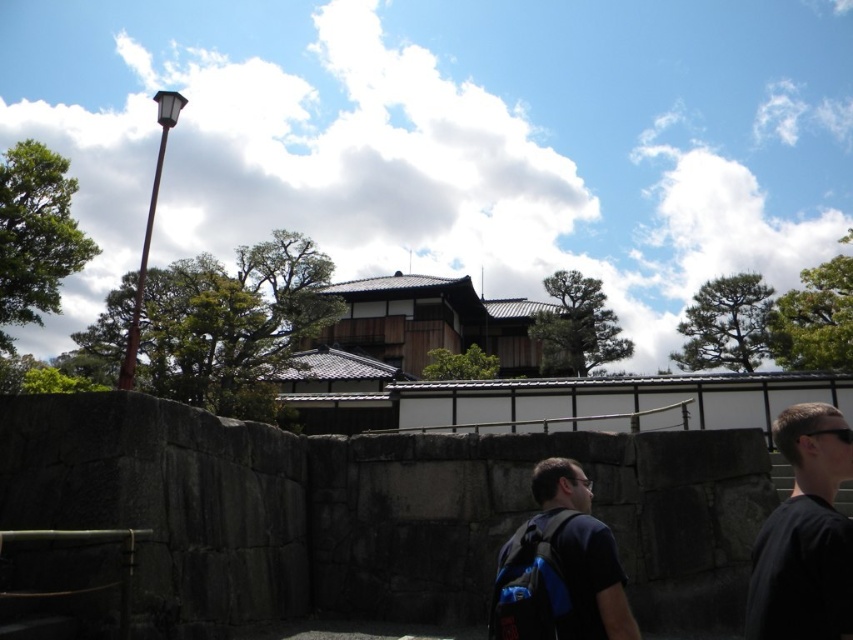
Between black fabric shirt at right and dark blue backpack at center, which one has less height?

With less height is black fabric shirt at right.

This screenshot has width=853, height=640. What do you see at coordinates (805, 536) in the screenshot?
I see `black fabric shirt at right` at bounding box center [805, 536].

You are a GUI agent. You are given a task and a screenshot of the screen. Output one action in this format:
    pyautogui.click(x=<x>, y=<y>)
    Task: Click on the black fabric shirt at right
    This screenshot has width=853, height=640.
    Given the screenshot: What is the action you would take?
    pyautogui.click(x=805, y=536)

Who is lower down, black fabric shirt at right or brown wooden temple at center?

black fabric shirt at right is below.

Who is more distant from viewer, (828, 532) or (538, 346)?

The point (538, 346) is more distant.

Where is `black fabric shirt at right`? This screenshot has height=640, width=853. black fabric shirt at right is located at coordinates (805, 536).

Does dark blue backpack at center appear under brown wooden temple at center?

Correct, dark blue backpack at center is located below brown wooden temple at center.

Who is lower down, dark blue backpack at center or brown wooden temple at center?

dark blue backpack at center is below.

Describe the element at coordinates (560, 566) in the screenshot. This screenshot has width=853, height=640. I see `dark blue backpack at center` at that location.

Where is `dark blue backpack at center`? The width and height of the screenshot is (853, 640). dark blue backpack at center is located at coordinates (560, 566).